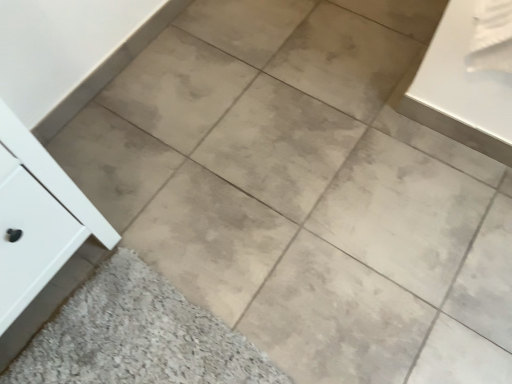
Question: From the image's perspective, is beige matte tile at lower left above or below white matte cabinet at left?

Choices:
 (A) below
 (B) above

Answer: (A)

Question: Choose the correct answer: Is beige matte tile at lower left inside white matte cabinet at left or outside it?

Choices:
 (A) inside
 (B) outside

Answer: (B)

Question: Considering the relative positions of beige matte tile at lower left and white matte cabinet at left in the image provided, is beige matte tile at lower left to the left or to the right of white matte cabinet at left?

Choices:
 (A) left
 (B) right

Answer: (B)

Question: From a real-world perspective, is white matte cabinet at left physically located above or below beige matte tile at lower left?

Choices:
 (A) below
 (B) above

Answer: (B)

Question: From the image's perspective, relative to beige matte tile at lower left, is white matte cabinet at left above or below?

Choices:
 (A) below
 (B) above

Answer: (B)

Question: From their relative heights in the image, would you say white matte cabinet at left is taller or shorter than beige matte tile at lower left?

Choices:
 (A) short
 (B) tall

Answer: (B)

Question: Would you say white matte cabinet at left is inside or outside beige matte tile at lower left?

Choices:
 (A) outside
 (B) inside

Answer: (A)